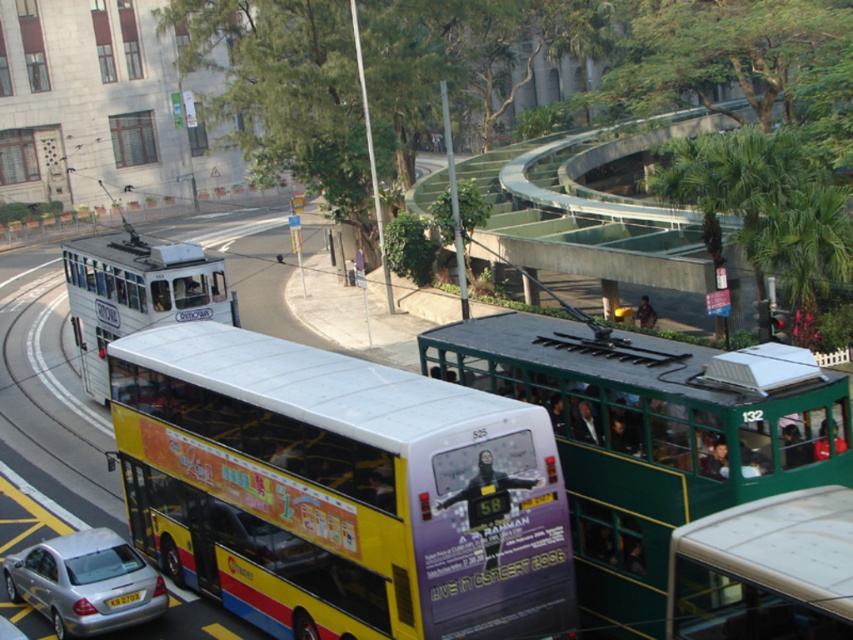
You are a city planner analyzing the layout of this urban scene. Given the coordinates of the yellow painted decker bus at center, what is its position relative to the tram?

The yellow painted decker bus at center is located at coordinates point (x=339, y=490). Since the tram is positioned to the right of the bus, the bus is to the left of the tram.

You are a pedestrian standing at the crosswalk. You see the yellow painted decker bus at center and the black plastic license plate at lower center. Which object is closer to you?

The black plastic license plate at lower center is closer to you because it is positioned under the yellow painted decker bus at center, which is above it.